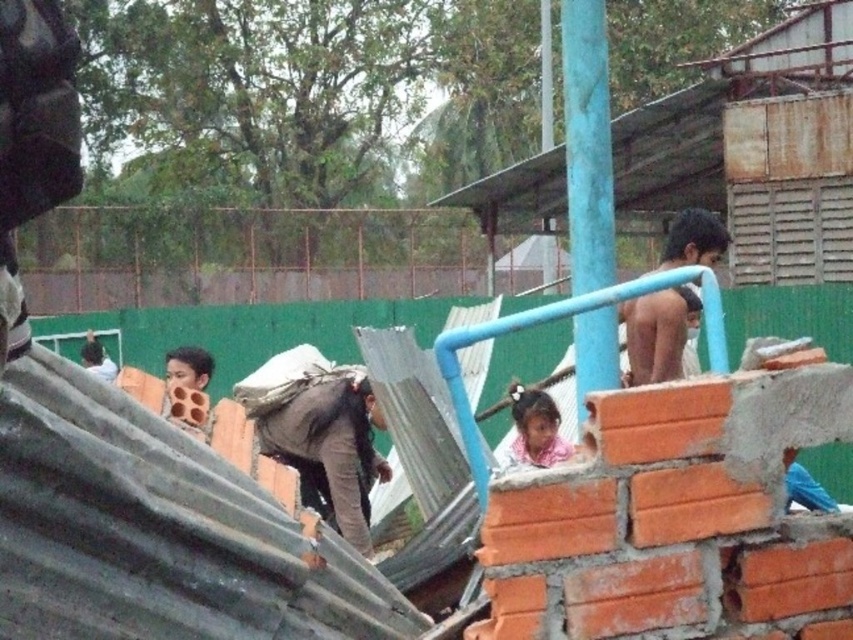
Question: Is the position of blue painted metal pole at upper center less distant than that of light brown fabric shirt at left?

Choices:
 (A) yes
 (B) no

Answer: (A)

Question: From the image, what is the correct spatial relationship of dark skin man at upper right in relation to light brown fabric shirt at left?

Choices:
 (A) above
 (B) below

Answer: (A)

Question: Which point is closer to the camera taking this photo?

Choices:
 (A) (540, 465)
 (B) (627, 312)
 (C) (585, 324)

Answer: (C)

Question: Considering the real-world distances, which object is closest to the dark skin man at upper right?

Choices:
 (A) pink fabric at upper center
 (B) blue painted metal pole at upper center

Answer: (B)

Question: Estimate the real-world distances between objects in this image. Which object is farther from the pink fabric at upper center?

Choices:
 (A) blue painted metal pole at upper center
 (B) dark skin man at upper right
 (C) light brown fabric shirt at left

Answer: (C)

Question: Can you confirm if dark skin man at upper right is wider than light brown fabric shirt at left?

Choices:
 (A) yes
 (B) no

Answer: (B)